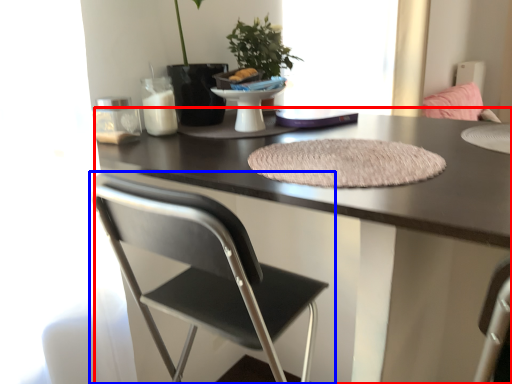
Question: Which of the following is the closest to the observer, desk (highlighted by a red box) or chair (highlighted by a blue box)?

Choices:
 (A) desk
 (B) chair

Answer: (A)